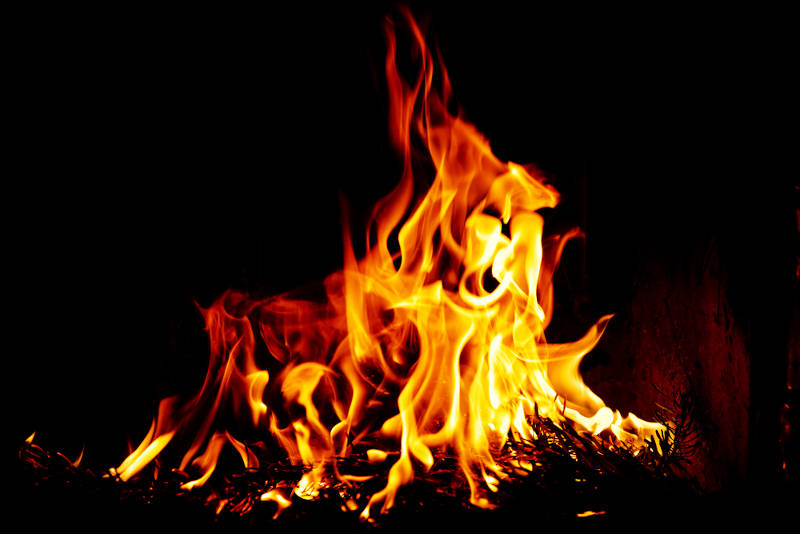
Identify the location of dark wall to the right of fire. This screenshot has height=534, width=800. (717, 345).